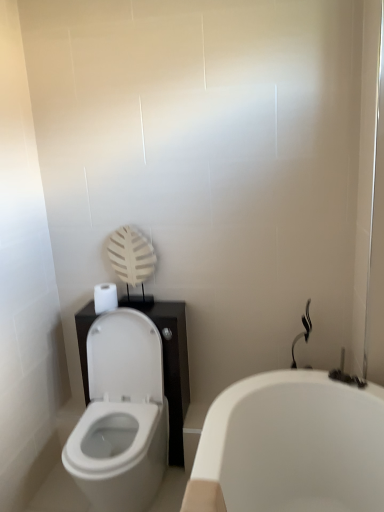
Describe the element at coordinates (302, 332) in the screenshot. The image size is (384, 512). I see `black glossy shower at right` at that location.

In order to face white matte toilet paper at left, should I rotate leftwards or rightwards?

To face it directly, rotate left by 11.596 degrees.

Where is `black glossy shower at right`? Image resolution: width=384 pixels, height=512 pixels. black glossy shower at right is located at coordinates (302, 332).

Would you say white matte toilet paper at left is a long distance from white glossy bathtub at lower right?

No, white matte toilet paper at left is in close proximity to white glossy bathtub at lower right.

This screenshot has height=512, width=384. I want to click on bathtub that appears below the white matte toilet paper at left (from the image's perspective), so click(x=290, y=447).

Which of these two, white matte toilet paper at left or white glossy bathtub at lower right, is bigger?

With larger size is white glossy bathtub at lower right.

Are white glossy bathtub at lower right and black glossy shower at right located far from each other?

They are positioned close to each other.

Considering the sizes of objects white glossy bathtub at lower right and black glossy shower at right in the image provided, who is bigger, white glossy bathtub at lower right or black glossy shower at right?

white glossy bathtub at lower right is bigger.

Is point (381, 430) farther from camera compared to point (302, 320)?

No, it is in front of (302, 320).

Is white glossy bathtub at lower right oriented away from black glossy shower at right?

That's not correct — white glossy bathtub at lower right is not looking away from black glossy shower at right.

How many degrees apart are the facing directions of black glossy shower at right and white glossy toilet at lower left?

They differ by 1.38 degrees in their facing directions.

Between black glossy shower at right and white glossy toilet at lower left, which one appears on the right side from the viewer's perspective?

black glossy shower at right.

Which of these two, black glossy shower at right or white glossy toilet at lower left, stands shorter?

black glossy shower at right is shorter.

Considering the relative sizes of black glossy shower at right and white glossy toilet at lower left in the image provided, is black glossy shower at right smaller than white glossy toilet at lower left?

Indeed, black glossy shower at right has a smaller size compared to white glossy toilet at lower left.

Between white glossy toilet at lower left and white glossy bathtub at lower right, which one appears on the left side from the viewer's perspective?

From the viewer's perspective, white glossy toilet at lower left appears more on the left side.

Is point (92, 461) farther from camera compared to point (241, 509)?

Yes, point (92, 461) is farther from viewer.

Is white glossy toilet at lower left bigger or smaller than white glossy bathtub at lower right?

Clearly, white glossy toilet at lower left is smaller in size than white glossy bathtub at lower right.

Which of these two, white glossy toilet at lower left or white glossy bathtub at lower right, stands shorter?

With less height is white glossy bathtub at lower right.

From a real-world perspective, is white glossy bathtub at lower right below white glossy toilet at lower left?

Yes, from a real-world perspective, white glossy bathtub at lower right is under white glossy toilet at lower left.

Is white glossy bathtub at lower right outside of white glossy toilet at lower left?

Yes.

Which object is further away from the camera, white glossy bathtub at lower right or white glossy toilet at lower left?

white glossy toilet at lower left is further away from the camera.

What's the angular difference between white glossy bathtub at lower right and white glossy toilet at lower left's facing directions?

90.2 degrees.

Between white matte toilet paper at left and white glossy toilet at lower left, which one appears on the left side from the viewer's perspective?

From the viewer's perspective, white matte toilet paper at left appears more on the left side.

From a real-world perspective, which is physically above, white matte toilet paper at left or white glossy toilet at lower left?

white matte toilet paper at left.

At what (x,y) coordinates should I click in order to perform the action: click on toilet paper above the white glossy toilet at lower left (from a real-world perspective). Please return your answer as a coordinate pair (x, y). Looking at the image, I should click on (105, 297).

Which is in front, point (104, 300) or point (162, 462)?

The point (104, 300) is closer to the camera.

From the image's perspective, between white glossy toilet at lower left and white matte toilet paper at left, which one is located above?

white matte toilet paper at left appears higher in the image.

From the picture: From a real-world perspective, is white glossy toilet at lower left above or below white matte toilet paper at left?

white glossy toilet at lower left is below white matte toilet paper at left.

Is white glossy toilet at lower left beside white matte toilet paper at left?

No, white glossy toilet at lower left is not touching white matte toilet paper at left.

Looking at this image, based on their positions, is white glossy toilet at lower left located to the left or right of white matte toilet paper at left?

Based on their positions, white glossy toilet at lower left is located to the right of white matte toilet paper at left.

In order to click on toilet paper located above the white glossy bathtub at lower right (from a real-world perspective) in this screenshot , I will do `click(105, 297)`.

This screenshot has width=384, height=512. What are the coordinates of `shower that appears on the right of white glossy bathtub at lower right` in the screenshot? It's located at (302, 332).

When comparing their distances from white glossy toilet at lower left, does white glossy bathtub at lower right or white matte toilet paper at left seem further?

white glossy bathtub at lower right is further to white glossy toilet at lower left.

From the picture: Which object lies nearer to the anchor point white glossy toilet at lower left, black glossy shower at right or white glossy bathtub at lower right?

white glossy bathtub at lower right is positioned closer to the anchor white glossy toilet at lower left.

Looking at the image, which one is located closer to white glossy bathtub at lower right, black glossy shower at right or white glossy toilet at lower left?

The object closer to white glossy bathtub at lower right is black glossy shower at right.

From the image, which object appears to be farther from white glossy bathtub at lower right, white matte toilet paper at left or black glossy shower at right?

white matte toilet paper at left is further to white glossy bathtub at lower right.

Considering their positions, is white glossy toilet at lower left positioned further to white glossy bathtub at lower right than white matte toilet paper at left?

white matte toilet paper at left lies further to white glossy bathtub at lower right than the other object.

Based on their spatial positions, is white glossy bathtub at lower right or white glossy toilet at lower left further from white matte toilet paper at left?

white glossy bathtub at lower right.

When comparing their distances from white glossy toilet at lower left, does white matte toilet paper at left or white glossy bathtub at lower right seem closer?

The object closer to white glossy toilet at lower left is white matte toilet paper at left.

When comparing their distances from black glossy shower at right, does white glossy toilet at lower left or white glossy bathtub at lower right seem further?

white glossy toilet at lower left is further to black glossy shower at right.

This screenshot has width=384, height=512. I want to click on bathtub situated between white glossy toilet at lower left and black glossy shower at right from left to right, so click(290, 447).

The width and height of the screenshot is (384, 512). Find the location of `shower positioned between white glossy bathtub at lower right and white matte toilet paper at left from near to far`. shower positioned between white glossy bathtub at lower right and white matte toilet paper at left from near to far is located at coordinates (302, 332).

This screenshot has height=512, width=384. Identify the location of toilet situated between white matte toilet paper at left and black glossy shower at right from left to right. (121, 415).

The width and height of the screenshot is (384, 512). Find the location of `toilet between white glossy bathtub at lower right and white matte toilet paper at left in the front-back direction`. toilet between white glossy bathtub at lower right and white matte toilet paper at left in the front-back direction is located at coordinates (121, 415).